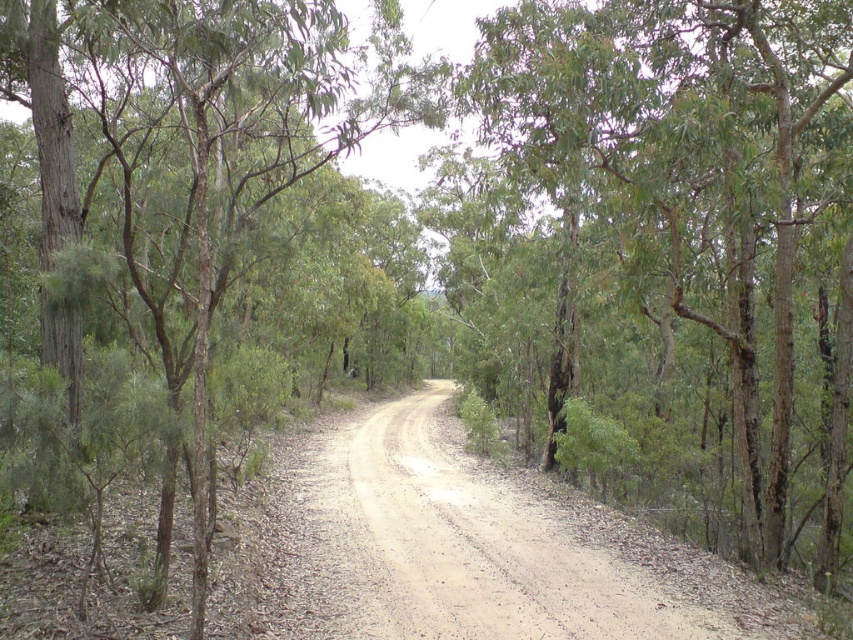
You are a hiker standing on the dusty gravel road at center. You notice a green rough bark tree at center nearby. Which object is taller from your viewpoint?

The green rough bark tree at center is taller than the dusty gravel road at center.